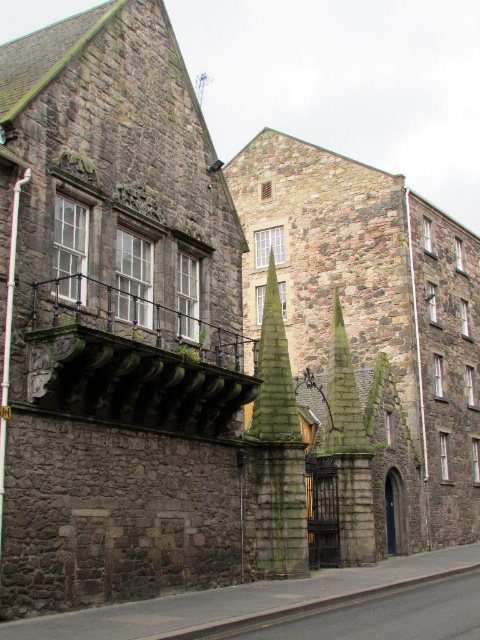
Question: Is smooth stone spire at center smaller than dark gray stone spire at center?

Choices:
 (A) yes
 (B) no

Answer: (B)

Question: Can you confirm if smooth stone spire at center is smaller than dark gray stone spire at center?

Choices:
 (A) no
 (B) yes

Answer: (A)

Question: Is smooth stone spire at center above dark gray stone spire at center?

Choices:
 (A) yes
 (B) no

Answer: (A)